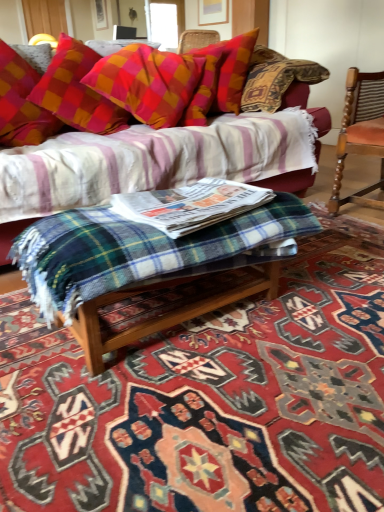
Question: Can you confirm if plaid fabric couch at upper center is wider than green plaid blanket at center?

Choices:
 (A) no
 (B) yes

Answer: (B)

Question: Can you confirm if plaid fabric couch at upper center is shorter than green plaid blanket at center?

Choices:
 (A) yes
 (B) no

Answer: (B)

Question: Does plaid fabric couch at upper center have a greater height compared to green plaid blanket at center?

Choices:
 (A) no
 (B) yes

Answer: (B)

Question: From a real-world perspective, is plaid fabric couch at upper center on top of green plaid blanket at center?

Choices:
 (A) no
 (B) yes

Answer: (B)

Question: From the image's perspective, does plaid fabric couch at upper center appear higher than green plaid blanket at center?

Choices:
 (A) yes
 (B) no

Answer: (A)

Question: Does plaid fabric couch at upper center appear on the left side of green plaid blanket at center?

Choices:
 (A) no
 (B) yes

Answer: (B)

Question: From a real-world perspective, is wooden chair with striped upholstery at right below plaid fabric couch at upper center?

Choices:
 (A) yes
 (B) no

Answer: (B)

Question: Is there a large distance between wooden chair with striped upholstery at right and plaid fabric couch at upper center?

Choices:
 (A) no
 (B) yes

Answer: (A)

Question: Does wooden chair with striped upholstery at right have a greater width compared to plaid fabric couch at upper center?

Choices:
 (A) no
 (B) yes

Answer: (A)

Question: Is wooden chair with striped upholstery at right turned away from plaid fabric couch at upper center?

Choices:
 (A) no
 (B) yes

Answer: (A)

Question: From the image's perspective, is wooden chair with striped upholstery at right located above plaid fabric couch at upper center?

Choices:
 (A) no
 (B) yes

Answer: (B)

Question: Does wooden chair with striped upholstery at right lie in front of plaid fabric couch at upper center?

Choices:
 (A) yes
 (B) no

Answer: (B)

Question: From a real-world perspective, does plaid fabric pillow at upper center sit lower than plaid fabric couch at upper center?

Choices:
 (A) no
 (B) yes

Answer: (A)